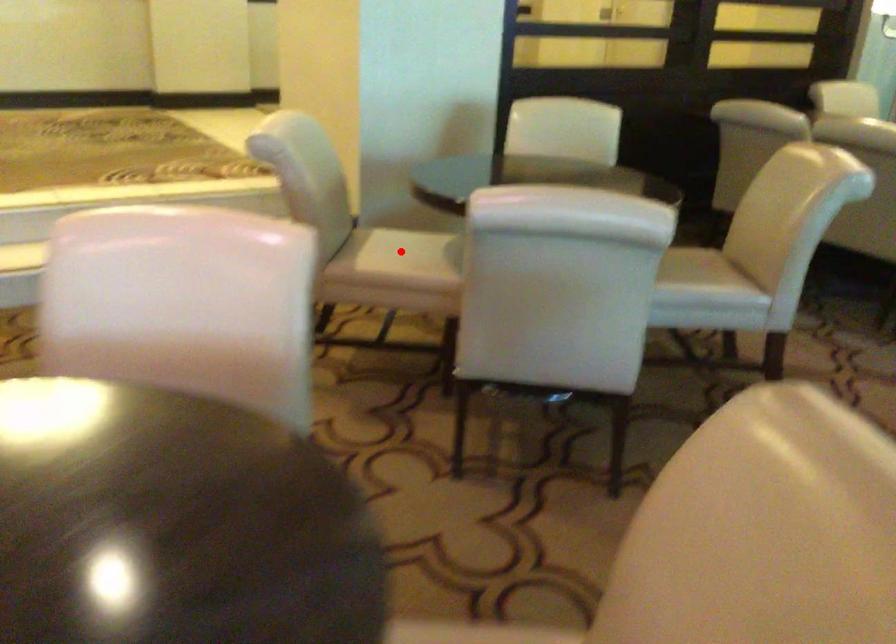
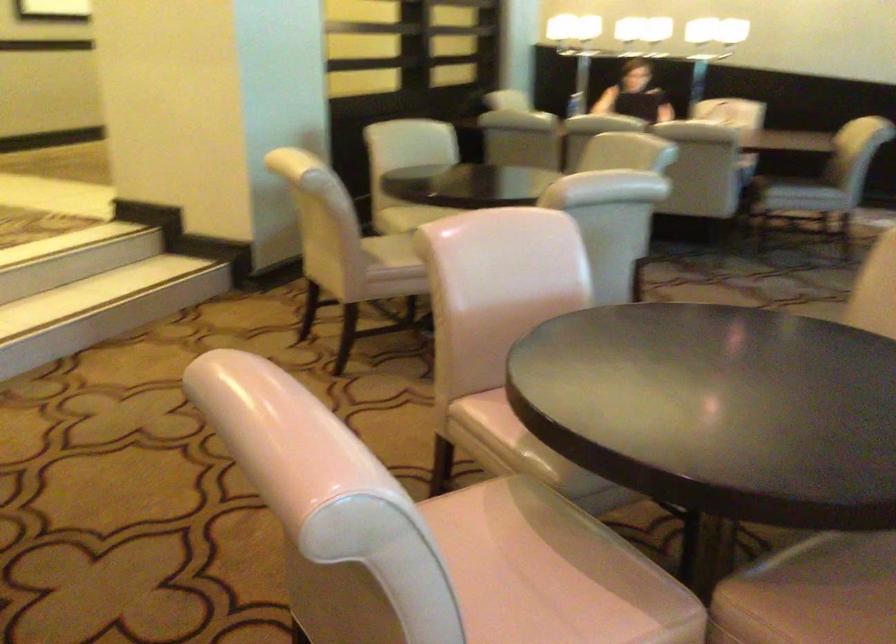
Find the pixel in the second image that matches the highlighted location in the first image.

(391, 252)